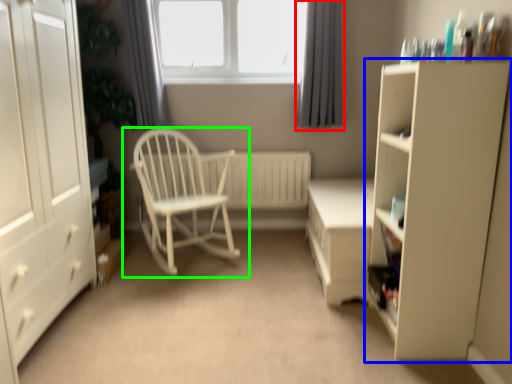
Question: Based on their relative distances, which object is nearer to curtain (highlighted by a red box)? Choose from cupboard (highlighted by a blue box) and chair (highlighted by a green box).

Choices:
 (A) cupboard
 (B) chair

Answer: (B)